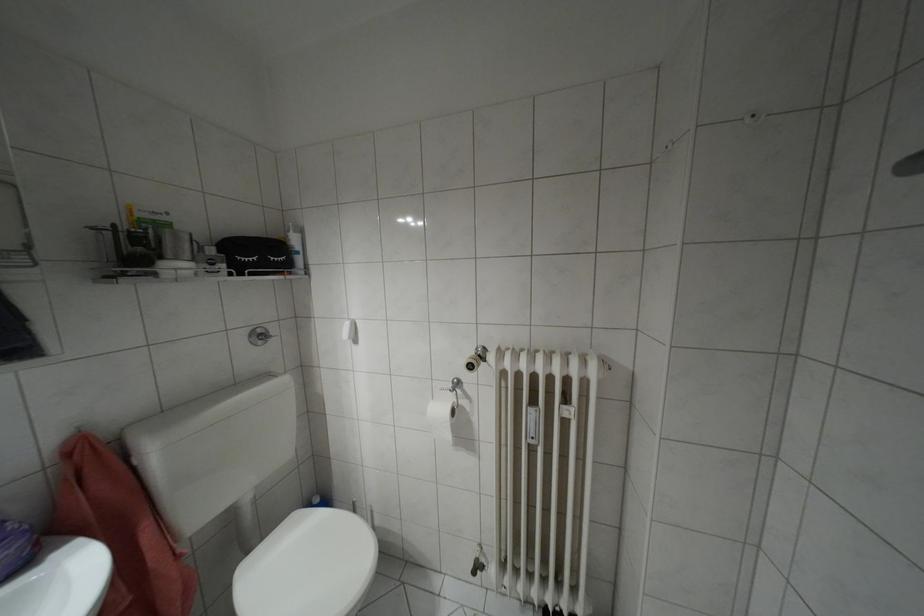
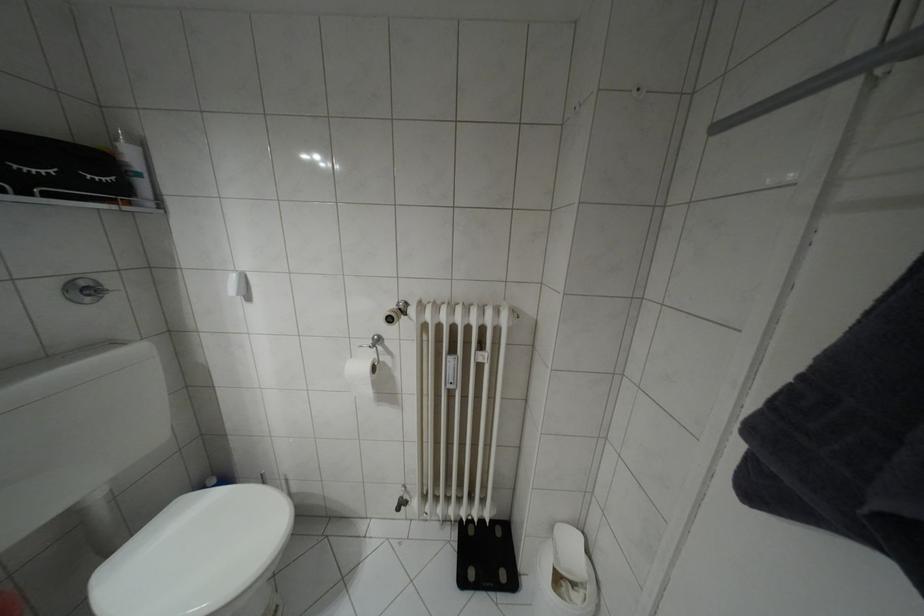
In the second image, find the point that corresponds to (x=258, y=331) in the first image.

(81, 284)